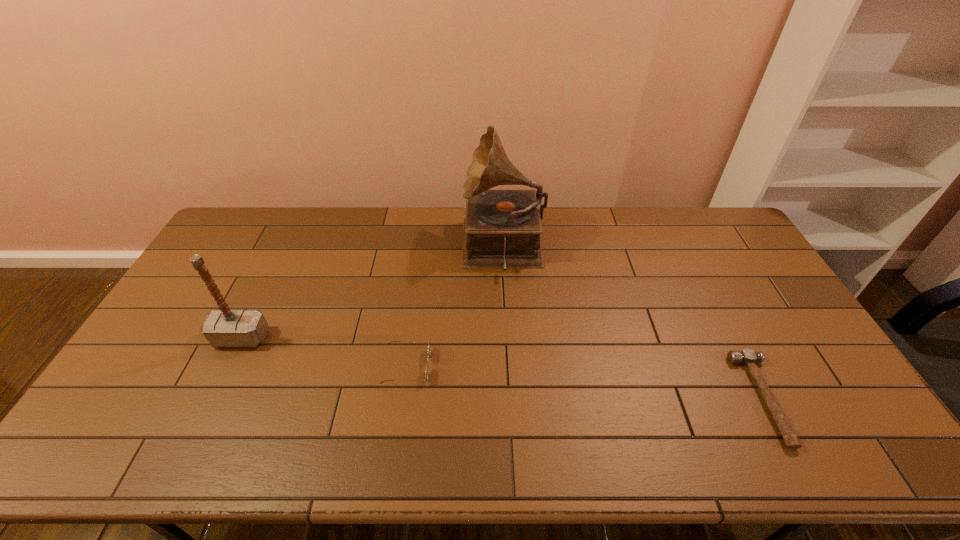
Find the location of `free spot between the tallest object and the shortest object`. free spot between the tallest object and the shortest object is located at coordinates (634, 323).

Locate an element on the screen. Image resolution: width=960 pixels, height=540 pixels. vacant region between the tallest object and the nearer hammer is located at coordinates (634, 323).

Locate an element on the screen. The width and height of the screenshot is (960, 540). free spot between the left hammer and the farthest object is located at coordinates (372, 293).

Identify the location of empty location between the second shortest object and the farther hammer. The height and width of the screenshot is (540, 960). tap(324, 352).

Identify the location of object that is the second closest to the second object from right to left. The image size is (960, 540). (748, 357).

Select which object is the third closest to the third shortest object. Please provide its 2D coordinates. Your answer should be formatted as a tuple, i.e. [(x, y)], where the tuple contains the x and y coordinates of a point satisfying the conditions above.

[(748, 357)]

In order to click on vacant position in the image that satisfies the following two spatial constraints: 1. from the horn of the tallest object; 2. on the striking surface of the left hammer in this screenshot , I will do `click(508, 338)`.

Locate an element on the screen. The image size is (960, 540). vacant space that satisfies the following two spatial constraints: 1. from the horn of the farthest object; 2. on the striking surface of the left hammer is located at coordinates (508, 338).